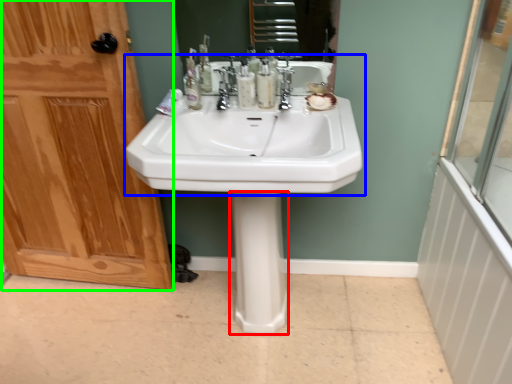
Question: Which object is positioned farthest from bidet (highlighted by a red box)? Select from sink (highlighted by a blue box) and door (highlighted by a green box).

Choices:
 (A) sink
 (B) door

Answer: (B)